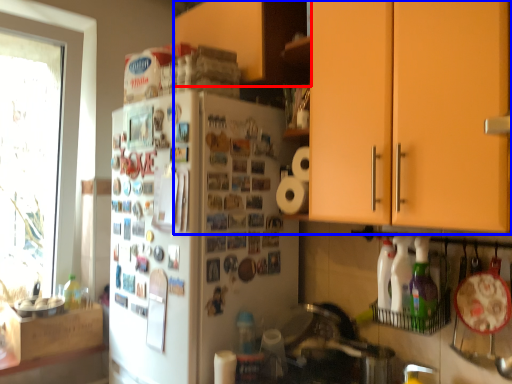
Question: Which of the following is the farthest to the observer, cabinetry (highlighted by a red box) or cabinetry (highlighted by a blue box)?

Choices:
 (A) cabinetry
 (B) cabinetry

Answer: (A)